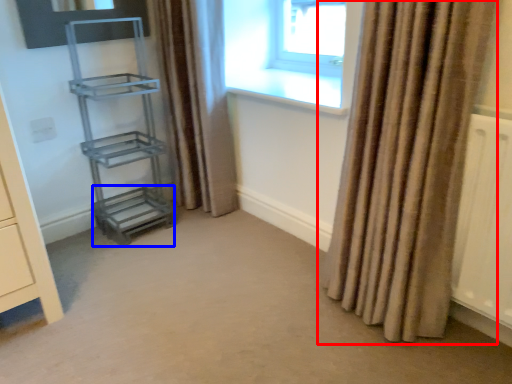
Question: Among these objects, which one is nearest to the camera, curtain (highlighted by a red box) or shelf (highlighted by a blue box)?

Choices:
 (A) curtain
 (B) shelf

Answer: (A)